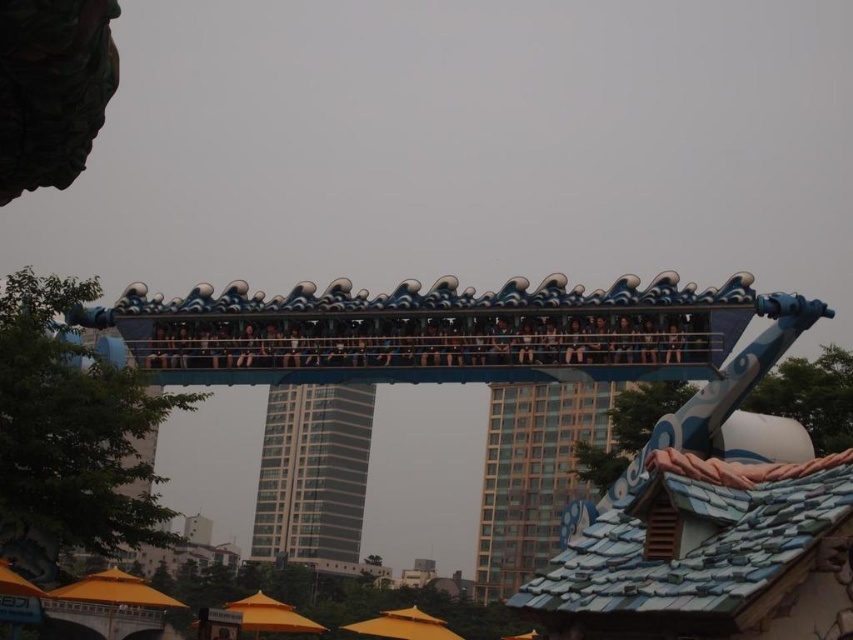
Question: Which point is farther to the camera?

Choices:
 (A) (120, 342)
 (B) (329, 328)

Answer: (A)

Question: Which point is closer to the camera taking this photo?

Choices:
 (A) (289, 362)
 (B) (587, 538)

Answer: (B)

Question: Can you confirm if blue glossy roller coaster at center is positioned below blue fabric seats at center?

Choices:
 (A) yes
 (B) no

Answer: (A)

Question: Does blue glossy roller coaster at center have a smaller size compared to blue fabric seats at center?

Choices:
 (A) yes
 (B) no

Answer: (B)

Question: From the image, what is the correct spatial relationship of blue glossy roller coaster at center in relation to blue fabric seats at center?

Choices:
 (A) right
 (B) left

Answer: (A)